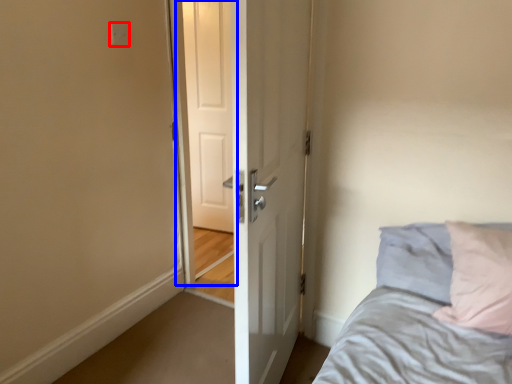
Question: Which object appears farthest to the camera in this image, electric outlet (highlighted by a red box) or screen door (highlighted by a blue box)?

Choices:
 (A) electric outlet
 (B) screen door

Answer: (B)